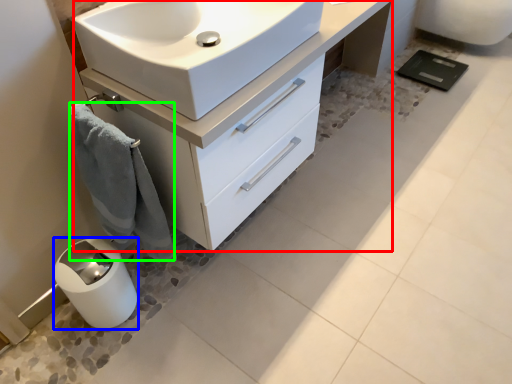
Question: Which is farther away from bathroom cabinet (highlighted by a red box)? appliance (highlighted by a blue box) or bath towel (highlighted by a green box)?

Choices:
 (A) appliance
 (B) bath towel

Answer: (A)